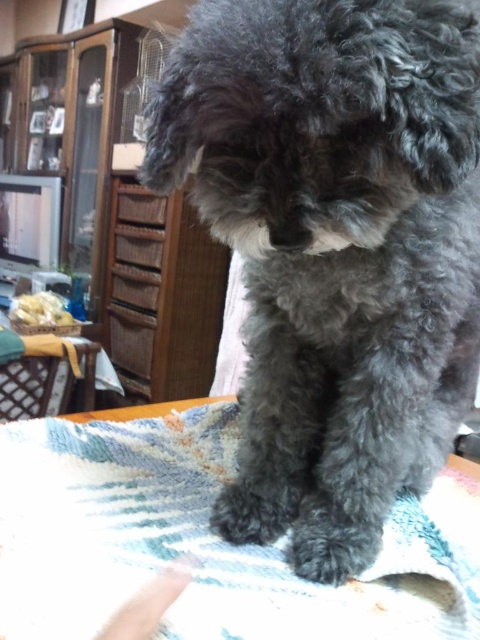
The height and width of the screenshot is (640, 480). Identify the location of dark gray fur at center. click(x=335, y=248).

The image size is (480, 640). What do you see at coordinates (335, 248) in the screenshot?
I see `dark gray fur at center` at bounding box center [335, 248].

What are the coordinates of `dark gray fur at center` in the screenshot? It's located at (335, 248).

Who is shorter, dark gray fur at center or blue textured blanket at lower center?

Standing shorter between the two is blue textured blanket at lower center.

Which is in front, point (408, 202) or point (346, 600)?

Point (408, 202)

Locate an element on the screen. dark gray fur at center is located at coordinates (335, 248).

Between point (442, 509) and point (149, 38), which one is positioned behind?

The point (149, 38) is more distant.

Between blue textured blanket at lower center and wooden dresser at upper left, which one is positioned higher?

wooden dresser at upper left is above.

Measure the distance between point (159, 442) and camera.

The distance of point (159, 442) from camera is 30.00 inches.

Find the location of a particular element. Image resolution: width=480 pixels, height=640 pixels. blue textured blanket at lower center is located at coordinates (204, 540).